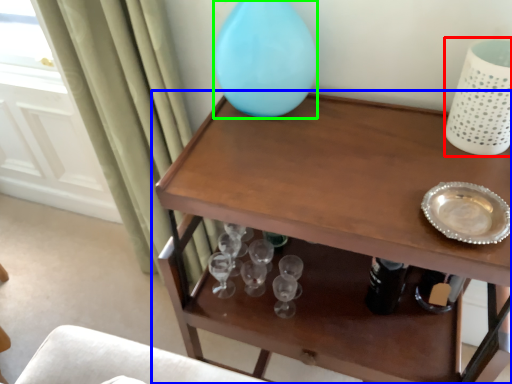
Question: Which is farther away from vase (highlighted by a red box)? table (highlighted by a blue box) or vase (highlighted by a green box)?

Choices:
 (A) table
 (B) vase

Answer: (B)